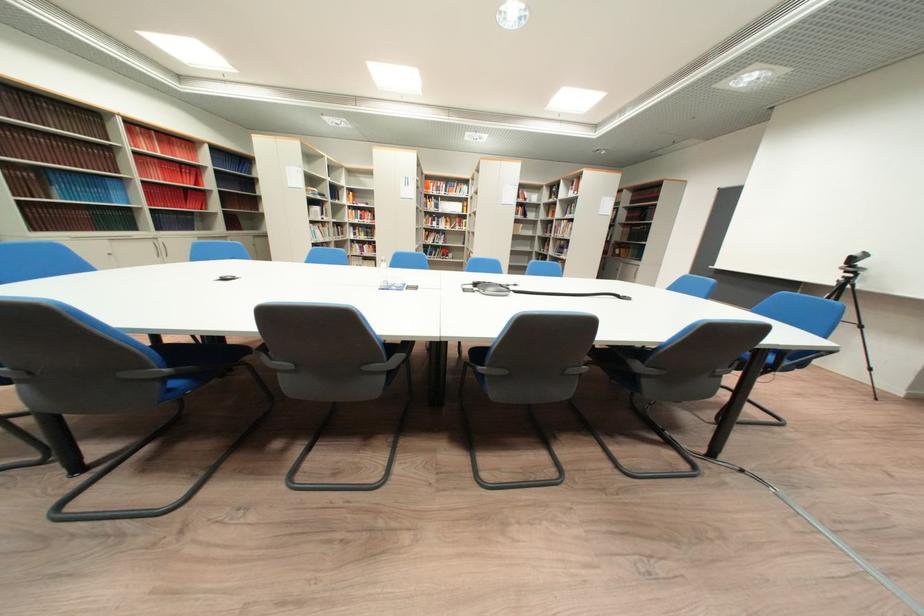
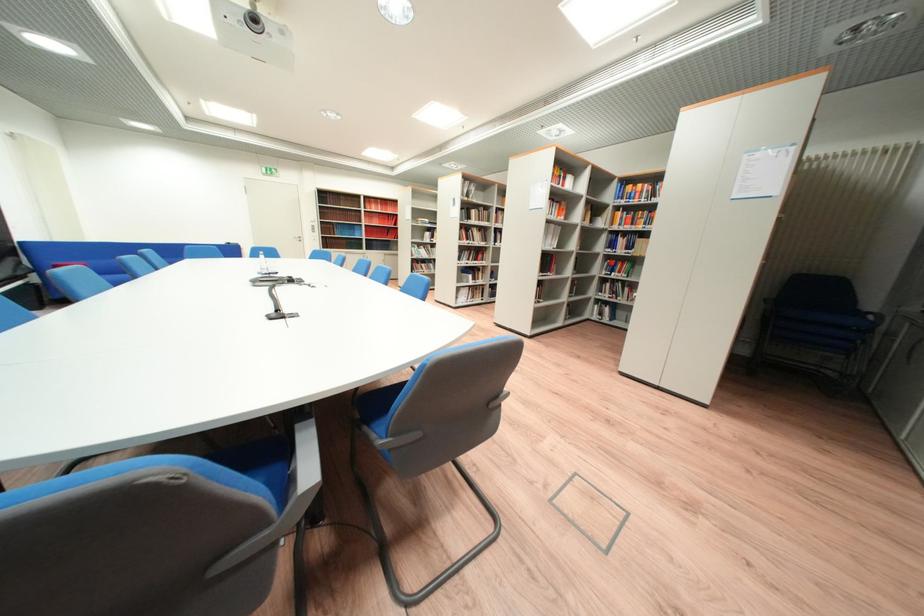
Question: I am providing you with two images of the same scene from different viewpoints. Which of the following objects are not visible in image2?

Choices:
 (A) blue book
 (B) blue chair sitting surface
 (C) patterned folded blanket
 (D) clear water bottle

Answer: (B)